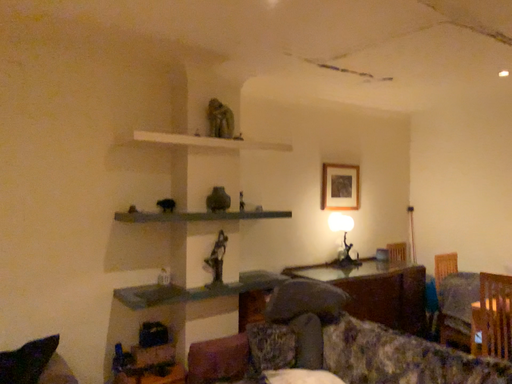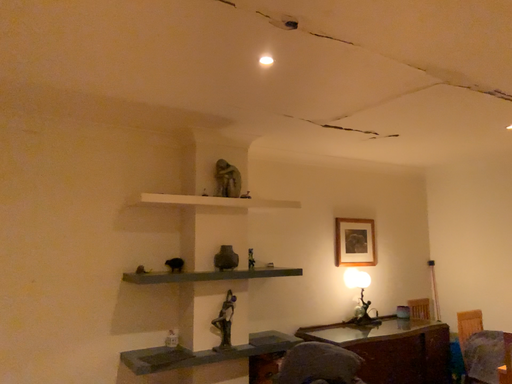
Question: Which way did the camera rotate in the video?

Choices:
 (A) rotated downward
 (B) rotated upward

Answer: (B)